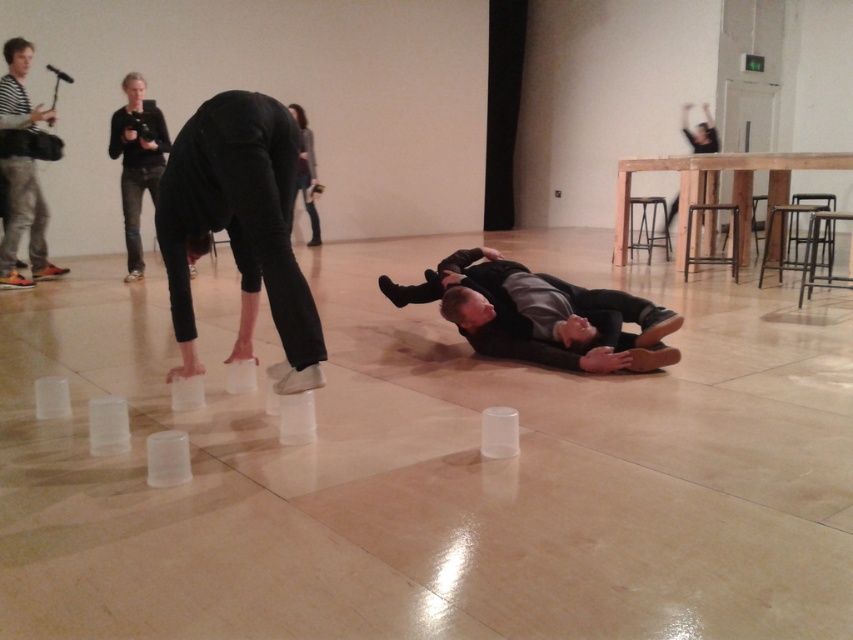
Question: Which of these objects is positioned closest to the wooden stool at center right?

Choices:
 (A) wooden stool at right
 (B) dark gray sweater at upper center

Answer: (A)

Question: Which object appears closest to the camera in this image?

Choices:
 (A) metallic silver stool at right
 (B) black matte stool at upper right
 (C) wooden stool at right

Answer: (A)

Question: Does black fabric camera at upper left have a greater width compared to metallic stool at right?

Choices:
 (A) no
 (B) yes

Answer: (A)

Question: Can you confirm if black matte stool at upper right is positioned to the left of wooden stool at right?

Choices:
 (A) no
 (B) yes

Answer: (B)

Question: Among these points, which one is farthest from the camera?

Choices:
 (A) tap(149, 172)
 (B) tap(805, 196)
 (C) tap(311, 156)

Answer: (C)

Question: Considering the relative positions of metallic silver stool at right and wooden stool at right in the image provided, where is metallic silver stool at right located with respect to wooden stool at right?

Choices:
 (A) right
 (B) left

Answer: (B)